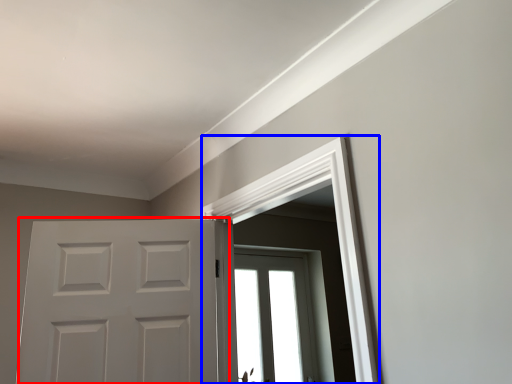
Question: Which point is further to the camera, door (highlighted by a red box) or window frame (highlighted by a blue box)?

Choices:
 (A) door
 (B) window frame

Answer: (A)